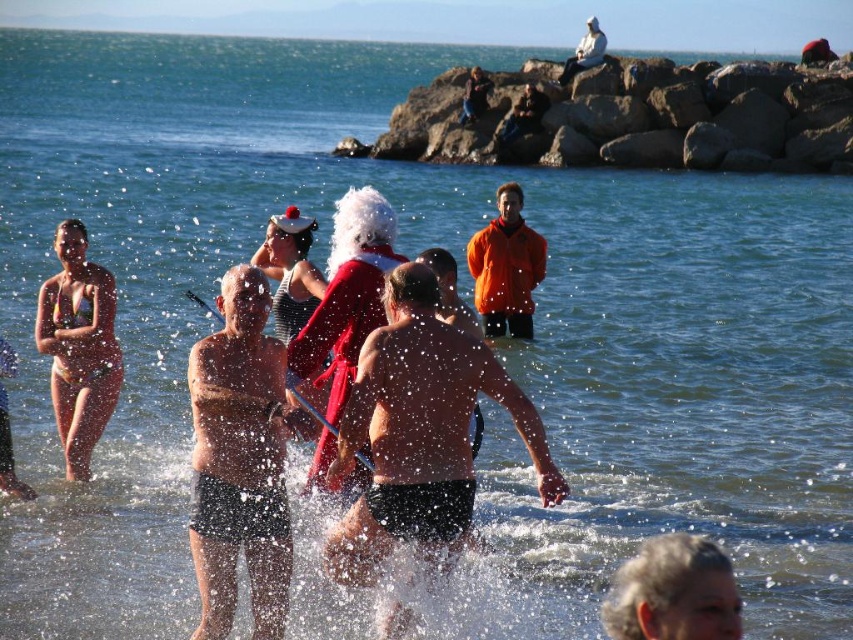
You are a photographer at the beach and want to capture a photo of the matte bikini at left and the santa hat at center. Which object should you focus on first if you want to include both in your frame?

The matte bikini at left is positioned on the left side of the santa hat at center, so you should focus on the santa hat at center first to ensure both are included in the frame.

Based on the photo, you are a photographer at the beach scene described. You need to capture a closeup shot of the gray hair at lower right. What coordinates should you aim for?

You should aim for the coordinates point (674,593) to capture the gray hair at lower right.